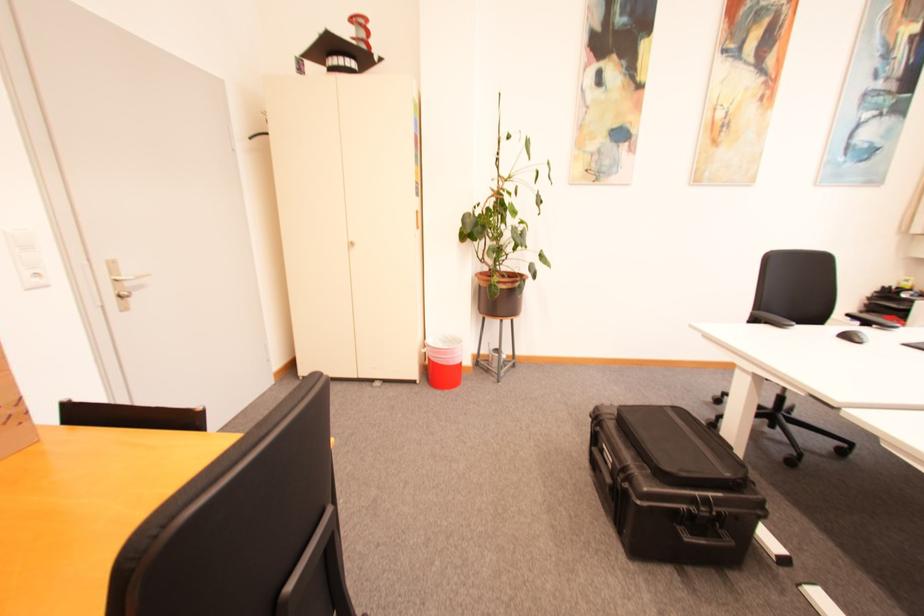
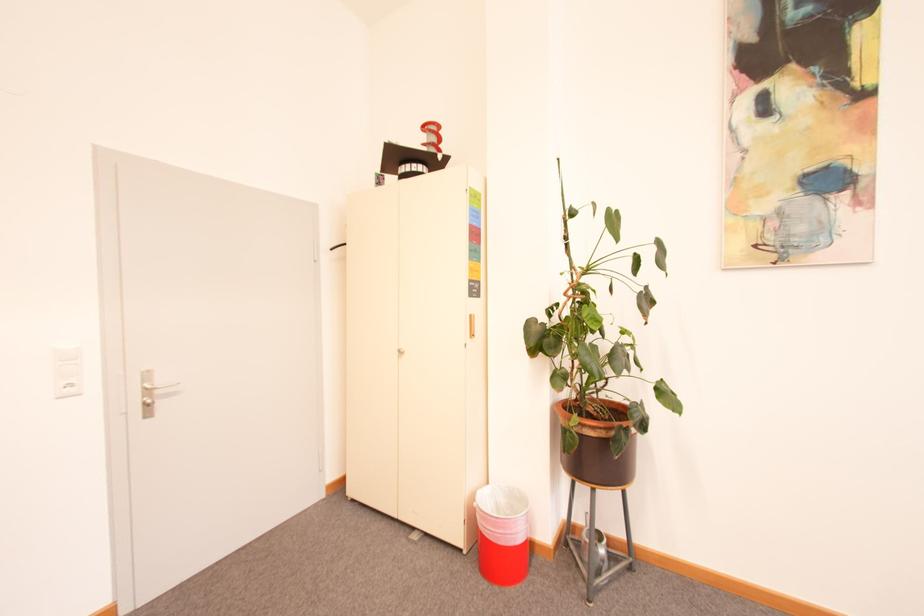
Question: The images are taken continuously from a first-person perspective. In which direction is your viewpoint rotating?

Choices:
 (A) Left
 (B) Right
 (C) Up
 (D) Down

Answer: (A)